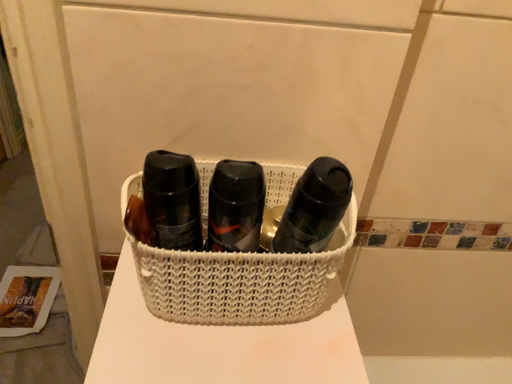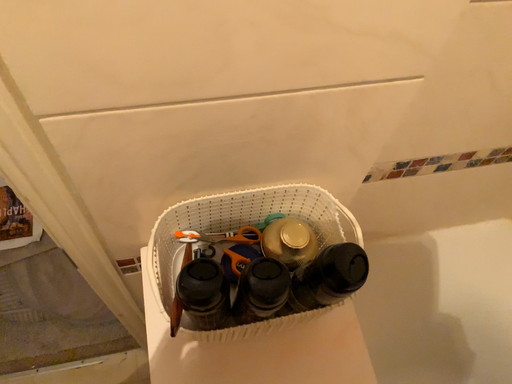
Question: How did the camera likely rotate when shooting the video?

Choices:
 (A) rotated downward
 (B) rotated upward

Answer: (A)